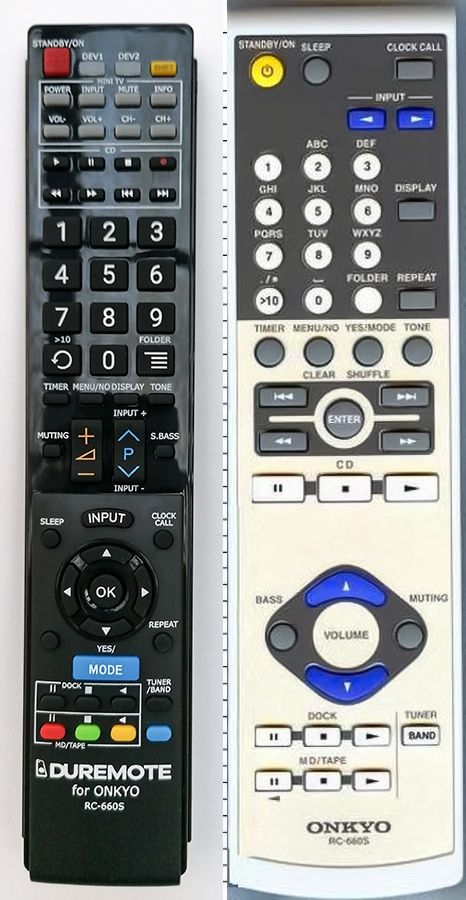
Identify the location of muting button. (411, 635), (52, 453).